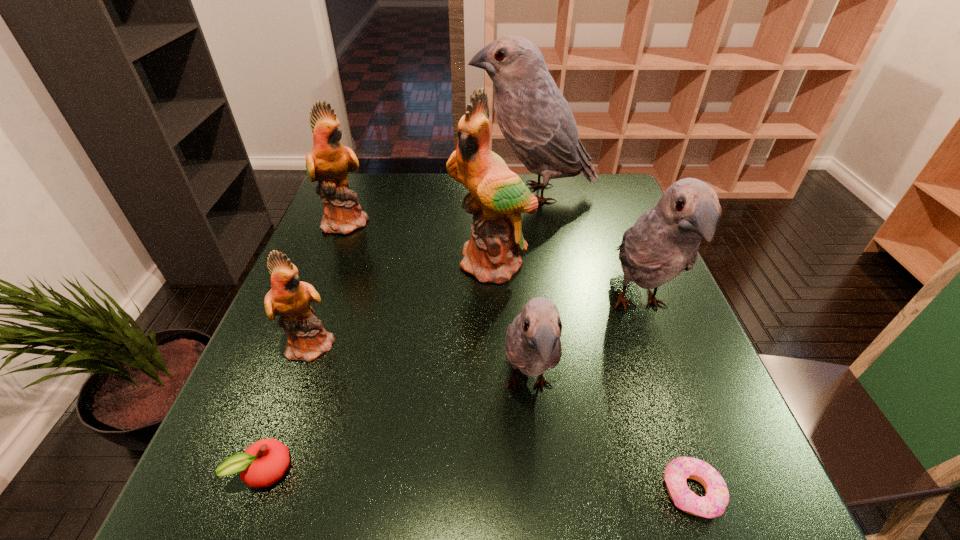
I want to click on doughnut, so click(713, 504).

Where is `blank space located on the front-facing side of the farthest gray parrot`? Image resolution: width=960 pixels, height=540 pixels. blank space located on the front-facing side of the farthest gray parrot is located at coordinates (442, 193).

This screenshot has width=960, height=540. I want to click on free space located 0.310m on the front-facing side of the farthest gray parrot, so click(x=372, y=193).

Identify the location of free space located 0.390m on the front-facing side of the farthest gray parrot. (346, 193).

Image resolution: width=960 pixels, height=540 pixels. Identify the location of vacant position located 0.350m on the front-facing side of the biggest green parrot. (498, 420).

Find the location of a particular element. vacant space located 0.290m on the front-facing side of the farthest green parrot is located at coordinates (472, 221).

Where is `vacant space located 0.260m on the front-facing side of the second biggest gray parrot`? vacant space located 0.260m on the front-facing side of the second biggest gray parrot is located at coordinates click(708, 491).

This screenshot has width=960, height=540. Identify the location of vacant space located 0.280m on the front-facing side of the smallest green parrot. (469, 344).

This screenshot has width=960, height=540. I want to click on vacant space located on the front-facing side of the smallest gray parrot, so click(540, 517).

Identify the location of free region located 0.400m on the back of the apple. (331, 289).